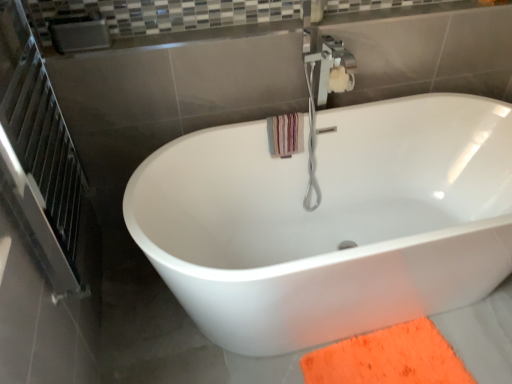
Question: Considering the positions of striped cotton beach towel at upper right and orange fuzzy doormat at lower right in the image, is striped cotton beach towel at upper right wider or thinner than orange fuzzy doormat at lower right?

Choices:
 (A) thin
 (B) wide

Answer: (A)

Question: Is striped cotton beach towel at upper right inside the boundaries of orange fuzzy doormat at lower right, or outside?

Choices:
 (A) outside
 (B) inside

Answer: (A)

Question: Considering the real-world distances, which object is farthest from the orange fuzzy doormat at lower right?

Choices:
 (A) striped cotton beach towel at upper right
 (B) white glossy bathtub at center
 (C) metallic silver screen door at left
 (D) brushed metal balustrade at upper center

Answer: (D)

Question: Which of these objects is positioned farthest from the striped cotton beach towel at upper right?

Choices:
 (A) white glossy bathtub at center
 (B) brushed metal balustrade at upper center
 (C) metallic silver screen door at left
 (D) orange fuzzy doormat at lower right

Answer: (D)